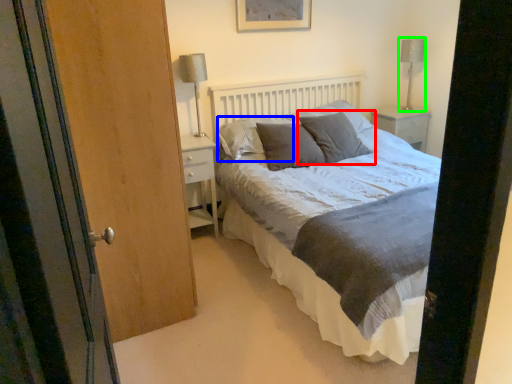
Question: Which is farther away from pillow (highlighted by a red box)? pillow (highlighted by a blue box) or table lamp (highlighted by a green box)?

Choices:
 (A) pillow
 (B) table lamp

Answer: (B)